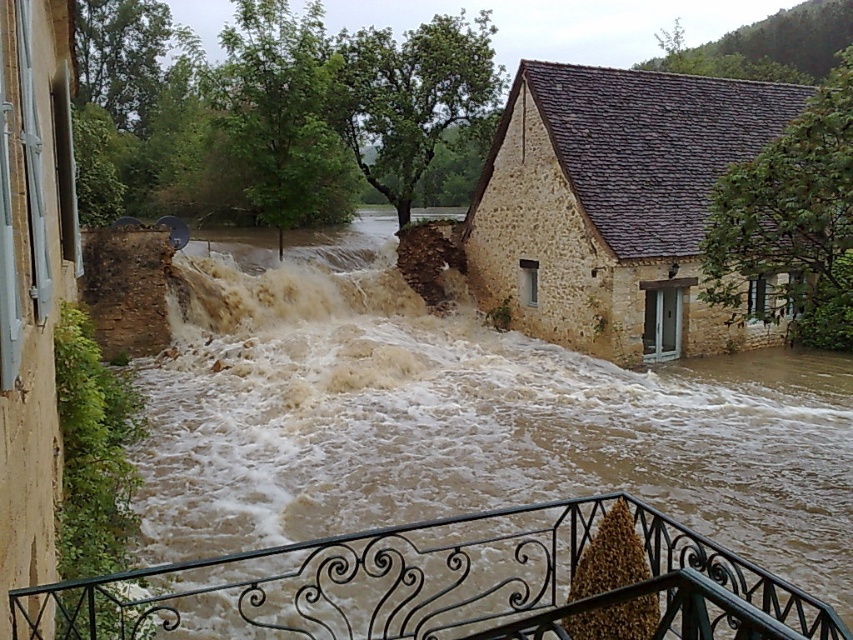
Between brown muddy water at center and black wrought iron at lower center, which one appears on the right side from the viewer's perspective?

brown muddy water at center

Which is below, brown muddy water at center or black wrought iron at lower center?

Positioned lower is black wrought iron at lower center.

Find the location of a particular element. brown muddy water at center is located at coordinates (463, 417).